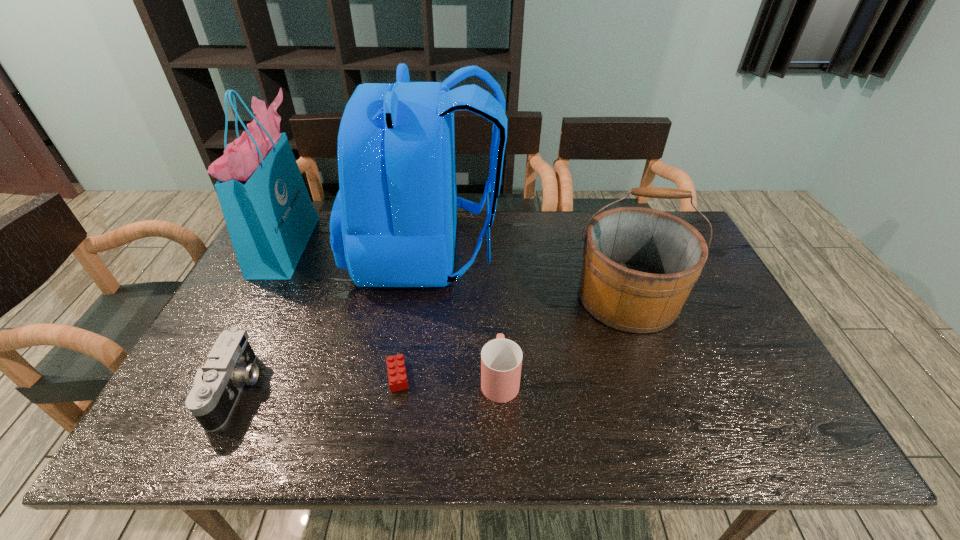
Identify the location of free space located 0.300m on the side of the cup with the handle. The image size is (960, 540). (495, 276).

Find the location of `blank area located 0.050m on the side of the cup with the handle`. blank area located 0.050m on the side of the cup with the handle is located at coordinates (498, 341).

Find the location of a particular element. vacant region located 0.050m on the side of the cup with the handle is located at coordinates (498, 341).

Find the location of a particular element. The image size is (960, 540). vacant space located 0.340m on the lens of the camera is located at coordinates (402, 389).

This screenshot has width=960, height=540. I want to click on vacant area situated 0.300m on the left of the Lego, so click(260, 376).

You are a GUI agent. You are given a task and a screenshot of the screen. Output one action in this format:
    pyautogui.click(x=<x>, y=<y>)
    Task: Click on the backpack that is at the far edge
    The height and width of the screenshot is (540, 960).
    Given the screenshot: What is the action you would take?
    pyautogui.click(x=393, y=223)

Identify the location of shopping bag situated at the far edge. Image resolution: width=960 pixels, height=540 pixels. (270, 217).

Where is `object that is positioned at the near edge`? The width and height of the screenshot is (960, 540). object that is positioned at the near edge is located at coordinates (230, 364).

Locate an element on the screen. The image size is (960, 540). shopping bag present at the left edge is located at coordinates (270, 217).

Image resolution: width=960 pixels, height=540 pixels. I want to click on camera present at the left edge, so click(x=230, y=364).